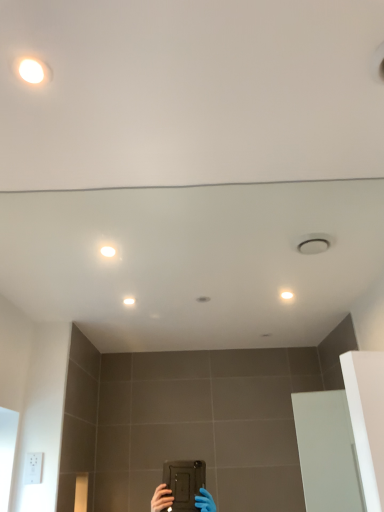
Find the location of a particular element. white glossy mirror at upper center is located at coordinates (177, 332).

Image resolution: width=384 pixels, height=512 pixels. What do you see at coordinates (177, 332) in the screenshot?
I see `white glossy mirror at upper center` at bounding box center [177, 332].

You are a GUI agent. You are given a task and a screenshot of the screen. Output one action in this format:
    pyautogui.click(x=<x>, y=<y>)
    Task: Click on the white glossy mirror at upper center
    The image size is (384, 512).
    Given the screenshot: What is the action you would take?
    (x=177, y=332)